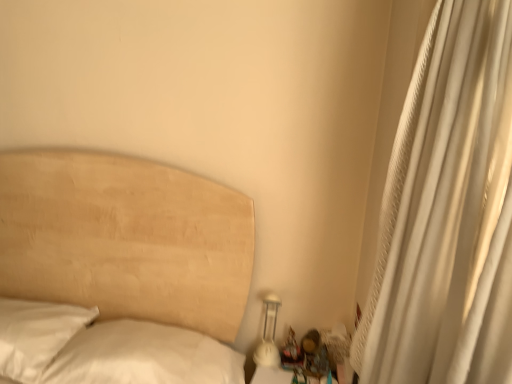
Measure the distance between point [326,366] and camera.

Point [326,366] is 1.73 meters from camera.

You are a GUI agent. You are given a task and a screenshot of the screen. Output one action in this format:
    pyautogui.click(x=<x>, y=<y>)
    Task: Click on the white textured curtain at right
    The image size is (512, 384).
    Given the screenshot: What is the action you would take?
    [448, 211]

At what (x,y) coordinates should I click in order to perform the action: click on wooden figurine at lower right. Please return your answer as a coordinate pair (x, y). This screenshot has width=512, height=384. Looking at the image, I should click on (315, 354).

Is white textured curtain at right in front of or behind white glossy bedside lamp at lower right in the image?

Visually, white textured curtain at right is located in front of white glossy bedside lamp at lower right.

From the image's perspective, relative to white glossy bedside lamp at lower right, is white textured curtain at right above or below?

From the image's perspective, white textured curtain at right appears above white glossy bedside lamp at lower right.

Is white glossy bedside lamp at lower right at the back of white textured curtain at right?

That's not correct — white textured curtain at right is not looking away from white glossy bedside lamp at lower right.

Locate an element on the screen. The height and width of the screenshot is (384, 512). curtain on the right of wooden figurine at lower right is located at coordinates (448, 211).

Does white textured curtain at right have a lesser width compared to wooden figurine at lower right?

In fact, white textured curtain at right might be wider than wooden figurine at lower right.

Consider the image. Is white textured curtain at right positioned before wooden figurine at lower right?

Yes, the depth of white textured curtain at right is less than that of wooden figurine at lower right.

From the image's perspective, does white textured curtain at right appear higher than wooden figurine at lower right?

Yes, from the image's perspective, white textured curtain at right is over wooden figurine at lower right.

Between wooden figurine at lower right and white glossy bedside lamp at lower right, which one has less height?

With less height is wooden figurine at lower right.

Is wooden figurine at lower right far away from white glossy bedside lamp at lower right?

wooden figurine at lower right is actually quite close to white glossy bedside lamp at lower right.

Would you say white glossy bedside lamp at lower right is part of wooden figurine at lower right's contents?

No, white glossy bedside lamp at lower right is not a part of wooden figurine at lower right.

Would you say white glossy bedside lamp at lower right is to the left or to the right of wooden figurine at lower right in the picture?

From the image, it's evident that white glossy bedside lamp at lower right is to the left of wooden figurine at lower right.

Is the position of white glossy bedside lamp at lower right less distant than that of wooden figurine at lower right?

No, it is not.

Measure the distance between white glossy bedside lamp at lower right and wooden figurine at lower right.

white glossy bedside lamp at lower right and wooden figurine at lower right are 6.37 inches apart from each other.

Does point (273, 318) appear closer or farther from the camera than point (322, 344)?

Point (273, 318) appears to be farther away from the viewer than point (322, 344).

Does white glossy bedside lamp at lower right have a greater height compared to white textured curtain at right?

In fact, white glossy bedside lamp at lower right may be shorter than white textured curtain at right.

From a real-world perspective, who is located lower, white glossy bedside lamp at lower right or white textured curtain at right?

In real-world perspective, white glossy bedside lamp at lower right is lower.

Is point (265, 343) less distant than point (404, 246)?

No, it is behind (404, 246).

Can you confirm if wooden figurine at lower right is bigger than white textured curtain at right?

No.

From a real-world perspective, is wooden figurine at lower right on white textured curtain at right?

Incorrect, from a real-world perspective, wooden figurine at lower right is lower than white textured curtain at right.

From the image's perspective, between wooden figurine at lower right and white textured curtain at right, which one is located above?

white textured curtain at right is shown above in the image.

Is wooden figurine at lower right placed right next to white textured curtain at right?

wooden figurine at lower right and white textured curtain at right are not in contact.

Identify the location of curtain above the white glossy bedside lamp at lower right (from the image's perspective). The height and width of the screenshot is (384, 512). (448, 211).

I want to click on curtain lying in front of the wooden figurine at lower right, so click(448, 211).

Looking at the image, which one is located closer to white glossy bedside lamp at lower right, white textured curtain at right or wooden figurine at lower right?

Among the two, wooden figurine at lower right is located nearer to white glossy bedside lamp at lower right.

From the picture: When comparing their distances from wooden figurine at lower right, does white textured curtain at right or white glossy bedside lamp at lower right seem further?

white textured curtain at right is positioned further to the anchor wooden figurine at lower right.

Which object lies nearer to the anchor point white textured curtain at right, wooden figurine at lower right or white glossy bedside lamp at lower right?

The object closer to white textured curtain at right is wooden figurine at lower right.

Based on the photo, considering their positions, is white glossy bedside lamp at lower right positioned further to white textured curtain at right than wooden figurine at lower right?

The object further to white textured curtain at right is white glossy bedside lamp at lower right.

When comparing their distances from wooden figurine at lower right, does white glossy bedside lamp at lower right or white textured curtain at right seem closer?

Among the two, white glossy bedside lamp at lower right is located nearer to wooden figurine at lower right.

From the picture: Estimate the real-world distances between objects in this image. Which object is closer to white glossy bedside lamp at lower right, wooden figurine at lower right or white textured curtain at right?

wooden figurine at lower right.

Locate an element on the screen. miniature between white textured curtain at right and white glossy bedside lamp at lower right in the front-back direction is located at coordinates (315, 354).